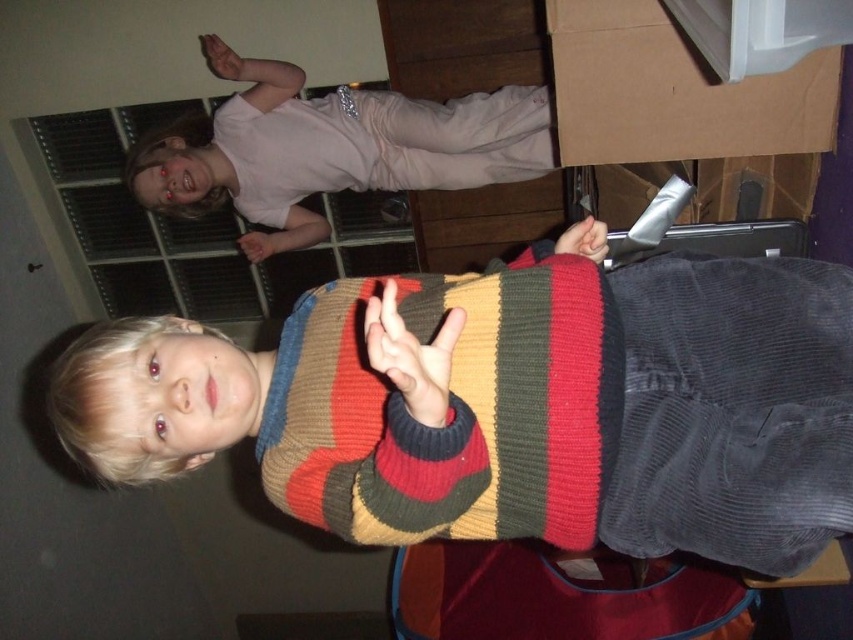
Looking at this image, you are standing in the room and want to know how far the point at coordinates (300, 326) is from you. Can you determine the distance?

The point at coordinates (300, 326) is 3.75 feet away from the camera, so you are 3.75 feet away from it.

Based on the scene description, what is located at the coordinates point (512, 404)?

The striped sweater at center is located at point (512, 404).

You are organizing a closet and see both the striped sweater at center and the striped wool sweater at center. Which one is on top?

The striped wool sweater at center is on top of the striped sweater at center.